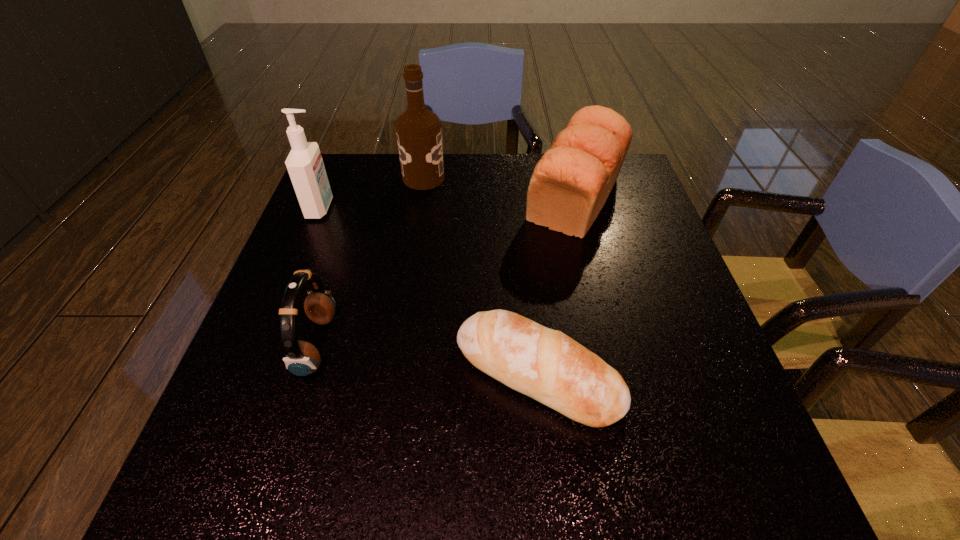
This screenshot has height=540, width=960. What are the coordinates of `vacant point located between the headset and the alcohol` in the screenshot? It's located at coord(371,261).

The image size is (960, 540). Identify the location of free space between the leftmost object and the third shortest object. (448, 203).

Locate an element on the screen. unoccupied position between the nearer bread and the headset is located at coordinates (428, 359).

Where is `vacant space in between the headset and the shortest object`? Image resolution: width=960 pixels, height=540 pixels. vacant space in between the headset and the shortest object is located at coordinates (428, 359).

In order to click on free space between the headset and the farther bread in this screenshot , I will do `click(446, 272)`.

The image size is (960, 540). Identify the location of free area in between the farther bread and the leftmost object. (448, 203).

The height and width of the screenshot is (540, 960). Identify the location of the third closest object to the third object from right to left. (302, 358).

Identify which object is located as the second nearest to the cleansing agent. Please provide its 2D coordinates. Your answer should be formatted as a tuple, i.e. [(x, y)], where the tuple contains the x and y coordinates of a point satisfying the conditions above.

[(302, 358)]

Where is `free spot that satisfies the following two spatial constraints: 1. on the front label of the shortest object; 2. on the right side of the leftmost object`? The width and height of the screenshot is (960, 540). free spot that satisfies the following two spatial constraints: 1. on the front label of the shortest object; 2. on the right side of the leftmost object is located at coordinates (252, 374).

Locate an element on the screen. free region that satisfies the following two spatial constraints: 1. on the front label of the cleansing agent; 2. on the back side of the shorter bread is located at coordinates (252, 374).